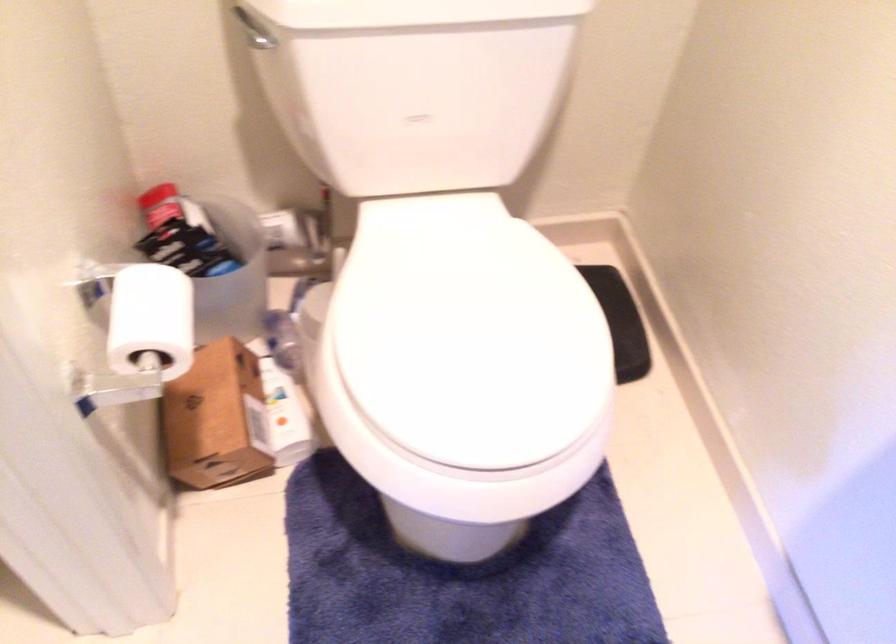
The height and width of the screenshot is (644, 896). Describe the element at coordinates (418, 104) in the screenshot. I see `a white toilet lid` at that location.